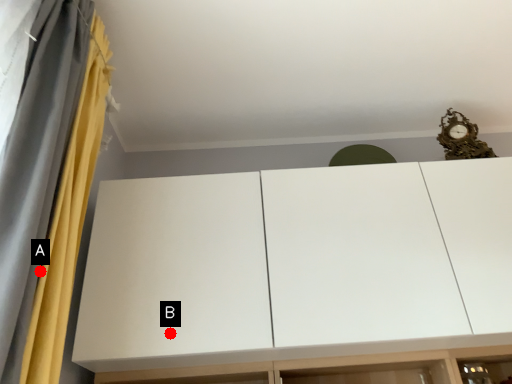
Question: Two points are circled on the image, labeled by A and B beside each circle. Which point is further to the camera?

Choices:
 (A) A is further
 (B) B is further

Answer: (B)